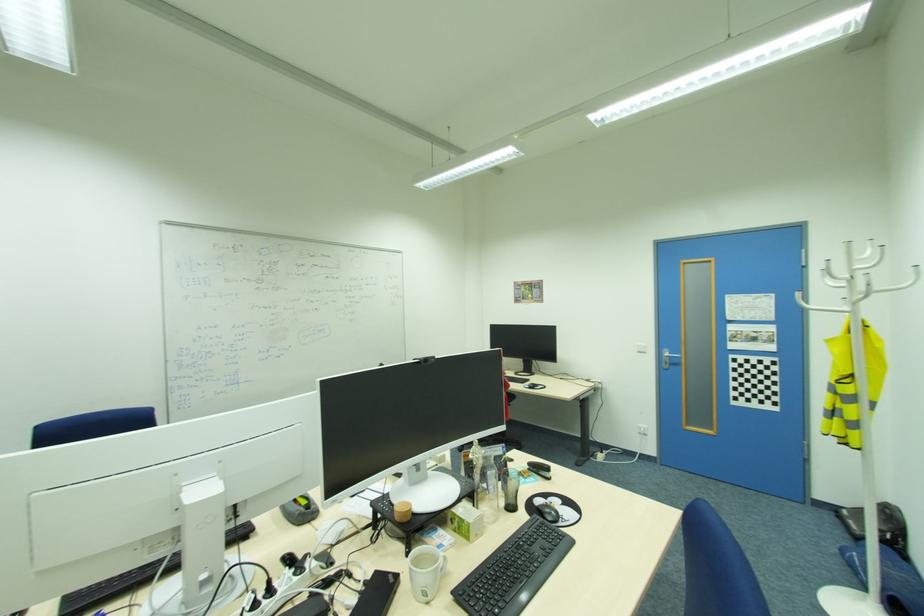
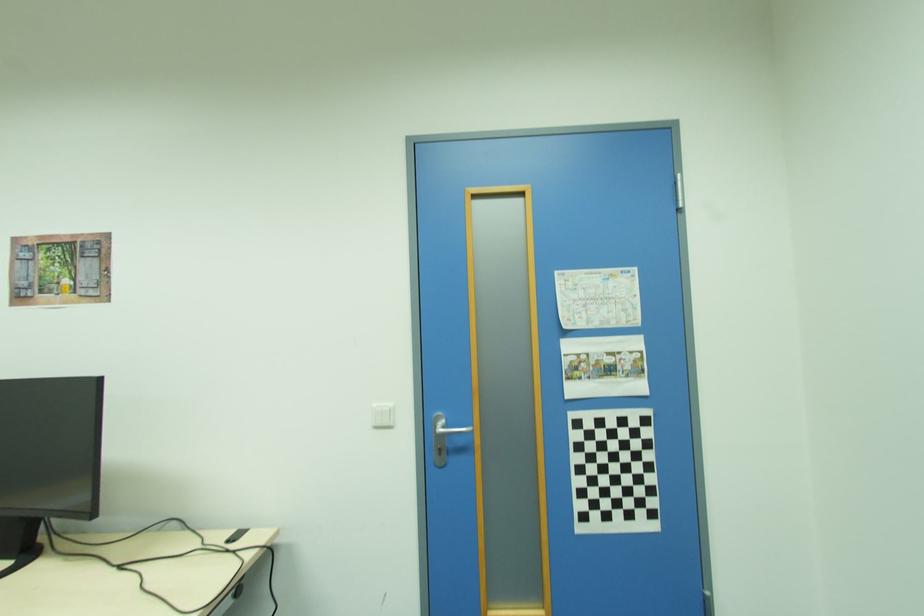
Where in the second image is the point corresponding to pixel 776 403 from the first image?

(655, 515)